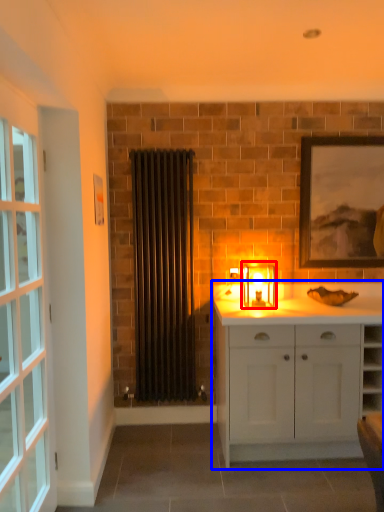
Question: Which of the following is the closest to the observer, candle holder (highlighted by a red box) or cabinetry (highlighted by a blue box)?

Choices:
 (A) candle holder
 (B) cabinetry

Answer: (B)